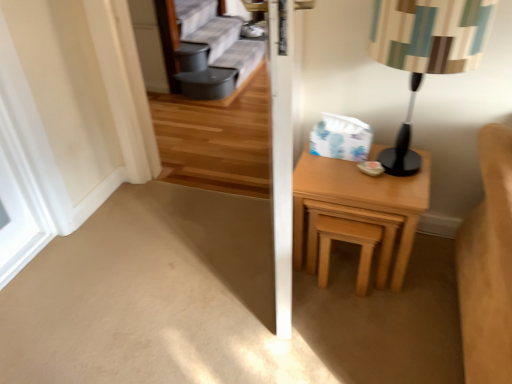
Where is `free spot in front of light brown wooden stool at right`? This screenshot has width=512, height=384. free spot in front of light brown wooden stool at right is located at coordinates (356, 312).